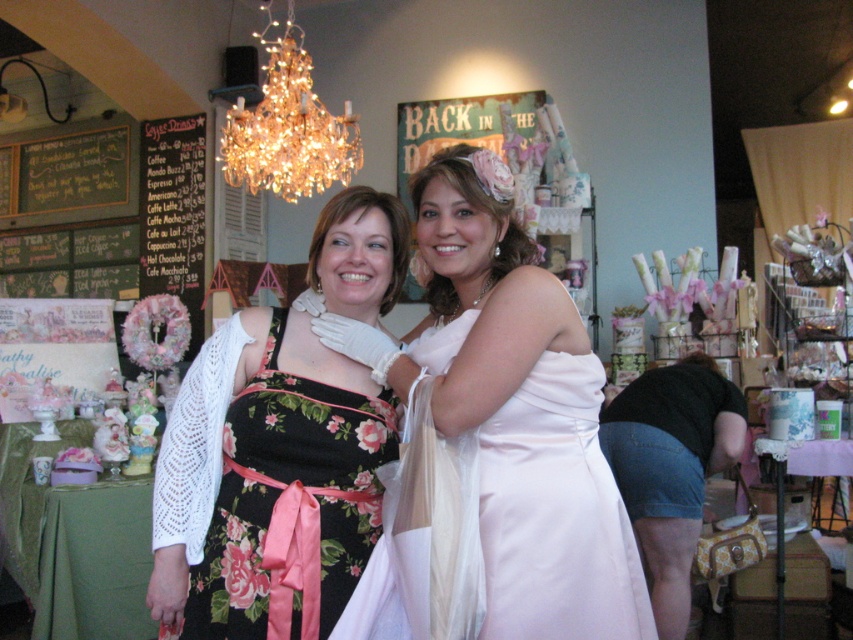
Question: Which of the following is the closest to the observer?

Choices:
 (A) floral dress at center
 (B) crystal gold chandelier at upper center

Answer: (A)

Question: From the image, what is the correct spatial relationship of satin dress at center in relation to black chalkboard menu at left?

Choices:
 (A) above
 (B) below

Answer: (B)

Question: Which of these objects is positioned closest to the crystal gold chandelier at upper center?

Choices:
 (A) floral dress at center
 (B) black chalkboard menu at left

Answer: (B)

Question: Does satin dress at center have a larger size compared to crystal gold chandelier at upper center?

Choices:
 (A) yes
 (B) no

Answer: (B)

Question: Observing the image, what is the correct spatial positioning of satin dress at center in reference to crystal gold chandelier at upper center?

Choices:
 (A) right
 (B) left

Answer: (A)

Question: Which point appears farthest from the camera in this image?

Choices:
 (A) (505, 253)
 (B) (296, 102)

Answer: (B)